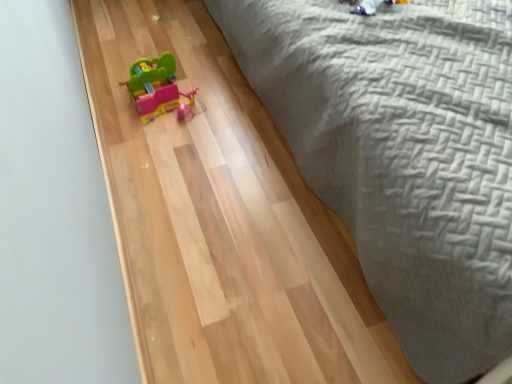
The height and width of the screenshot is (384, 512). Describe the element at coordinates (402, 154) in the screenshot. I see `gray woven bedspread at upper right` at that location.

Identify the location of gray woven bedspread at upper right. (402, 154).

Where is `matte plastic toy car at center`? The image size is (512, 384). matte plastic toy car at center is located at coordinates (156, 88).

The width and height of the screenshot is (512, 384). What do you see at coordinates (156, 88) in the screenshot? I see `matte plastic toy car at center` at bounding box center [156, 88].

Find the location of `gray woven bedspread at upper right`. gray woven bedspread at upper right is located at coordinates (402, 154).

Which object is positioned more to the right, matte plastic toy car at center or gray woven bedspread at upper right?

gray woven bedspread at upper right is more to the right.

Is matte plastic toy car at center in front of or behind gray woven bedspread at upper right in the image?

Clearly, matte plastic toy car at center is behind gray woven bedspread at upper right.

Does point (153, 71) come in front of point (415, 277)?

No, (153, 71) is behind (415, 277).

From the picture: From the image's perspective, between matte plastic toy car at center and gray woven bedspread at upper right, who is located below?

matte plastic toy car at center is shown below in the image.

From a real-world perspective, is matte plastic toy car at center located beneath gray woven bedspread at upper right?

Yes, from a real-world perspective, matte plastic toy car at center is under gray woven bedspread at upper right.

Is matte plastic toy car at center thinner than gray woven bedspread at upper right?

Correct, the width of matte plastic toy car at center is less than that of gray woven bedspread at upper right.

Does matte plastic toy car at center have a lesser height compared to gray woven bedspread at upper right?

Correct, matte plastic toy car at center is not as tall as gray woven bedspread at upper right.

Considering the sizes of objects matte plastic toy car at center and gray woven bedspread at upper right in the image provided, who is bigger, matte plastic toy car at center or gray woven bedspread at upper right?

Bigger between the two is gray woven bedspread at upper right.

Is gray woven bedspread at upper right a part of matte plastic toy car at center?

No.

Are matte plastic toy car at center and gray woven bedspread at upper right beside each other?

No, matte plastic toy car at center is not next to gray woven bedspread at upper right.

Does matte plastic toy car at center turn towards gray woven bedspread at upper right?

Yes, matte plastic toy car at center is turned towards gray woven bedspread at upper right.

Measure the distance between matte plastic toy car at center and gray woven bedspread at upper right.

25.46 inches.

Image resolution: width=512 pixels, height=384 pixels. I want to click on toy that appears on the left of gray woven bedspread at upper right, so click(156, 88).

Considering the relative positions of gray woven bedspread at upper right and matte plastic toy car at center in the image provided, is gray woven bedspread at upper right to the left of matte plastic toy car at center from the viewer's perspective?

Incorrect, gray woven bedspread at upper right is not on the left side of matte plastic toy car at center.

Is the depth of gray woven bedspread at upper right greater than that of matte plastic toy car at center?

No, gray woven bedspread at upper right is in front of matte plastic toy car at center.

Considering the points (454, 104) and (164, 96), which point is behind, point (454, 104) or point (164, 96)?

Point (164, 96)

From the image's perspective, between gray woven bedspread at upper right and matte plastic toy car at center, who is located below?

matte plastic toy car at center, from the image's perspective.

From a real-world perspective, relative to matte plastic toy car at center, is gray woven bedspread at upper right vertically above or below?

gray woven bedspread at upper right is situated higher than matte plastic toy car at center in the real world.

Is gray woven bedspread at upper right wider or thinner than matte plastic toy car at center?

Clearly, gray woven bedspread at upper right has more width compared to matte plastic toy car at center.

Considering the sizes of objects gray woven bedspread at upper right and matte plastic toy car at center in the image provided, who is taller, gray woven bedspread at upper right or matte plastic toy car at center?

With more height is gray woven bedspread at upper right.

Can you confirm if gray woven bedspread at upper right is bigger than matte plastic toy car at center?

Yes.

Is matte plastic toy car at center completely or partially inside gray woven bedspread at upper right?

No, matte plastic toy car at center is not a part of gray woven bedspread at upper right.

Is gray woven bedspread at upper right not near matte plastic toy car at center?

A: No, there isn't a large distance between gray woven bedspread at upper right and matte plastic toy car at center.

Is gray woven bedspread at upper right oriented towards matte plastic toy car at center?

No, gray woven bedspread at upper right is not aimed at matte plastic toy car at center.

Measure the distance from gray woven bedspread at upper right to matte plastic toy car at center.

gray woven bedspread at upper right and matte plastic toy car at center are 25.46 inches apart.

The width and height of the screenshot is (512, 384). I want to click on toy behind the gray woven bedspread at upper right, so click(156, 88).

This screenshot has height=384, width=512. I want to click on toy located on the left of gray woven bedspread at upper right, so click(156, 88).

Image resolution: width=512 pixels, height=384 pixels. What are the coordinates of `bed to the right of matte plastic toy car at center` in the screenshot? It's located at [402, 154].